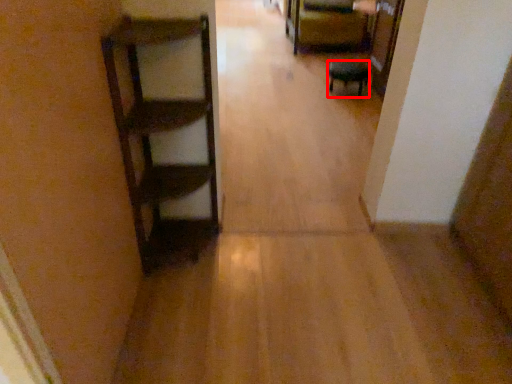
Question: From the image, what is the correct spatial relationship of furniture (annotated by the red box) in relation to furniture?

Choices:
 (A) right
 (B) left

Answer: (A)